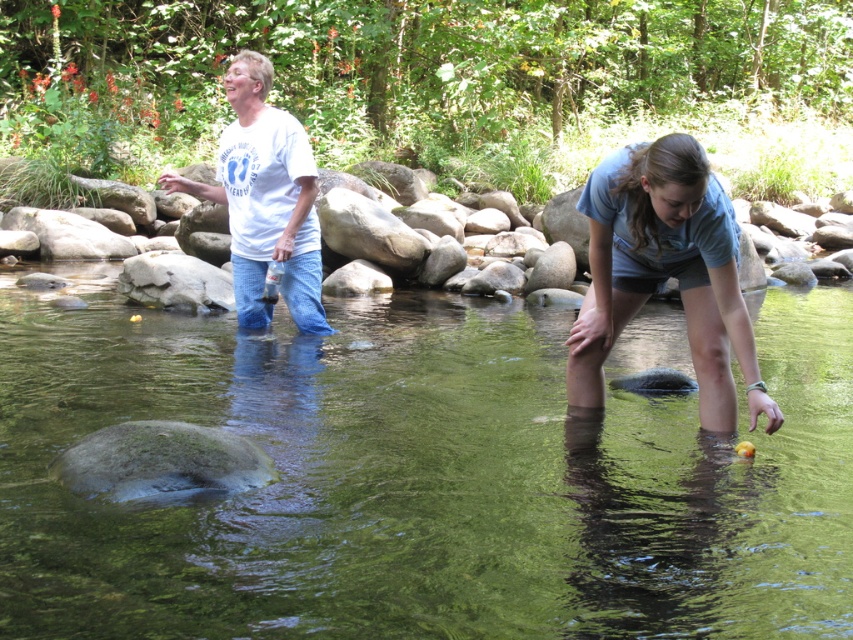
Is green translucent water at center above white cotton shirt at upper left?

Incorrect, green translucent water at center is not positioned above white cotton shirt at upper left.

Can you confirm if green translucent water at center is shorter than white cotton shirt at upper left?

Indeed, green translucent water at center has a lesser height compared to white cotton shirt at upper left.

Does point (666, 324) come farther from viewer compared to point (637, 250)?

Yes.

This screenshot has width=853, height=640. What are the coordinates of `green translucent water at center` in the screenshot? It's located at (421, 477).

Can you confirm if white cotton shirt at upper left is positioned above white cotton t-shirt at upper left?

No.

You are a GUI agent. You are given a task and a screenshot of the screen. Output one action in this format:
    pyautogui.click(x=<x>, y=<y>)
    Task: Click on the white cotton shirt at upper left
    This screenshot has height=640, width=853.
    Given the screenshot: What is the action you would take?
    pyautogui.click(x=666, y=275)

Is white cotton shirt at upper left thinner than light blue t-shirt at lower right?

In fact, white cotton shirt at upper left might be wider than light blue t-shirt at lower right.

Who is shorter, white cotton shirt at upper left or light blue t-shirt at lower right?

With less height is white cotton shirt at upper left.

The height and width of the screenshot is (640, 853). Identify the location of white cotton shirt at upper left. (666, 275).

The width and height of the screenshot is (853, 640). In order to click on white cotton shirt at upper left in this screenshot , I will do `click(666, 275)`.